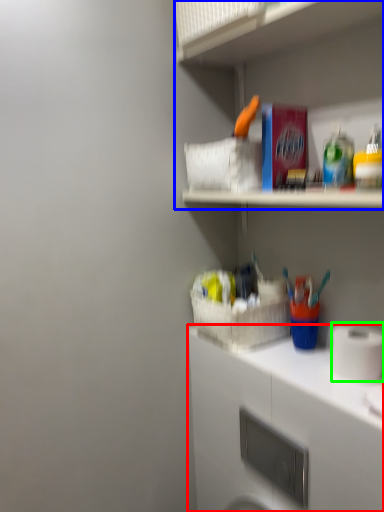
Question: Which object is the farthest from cabinetry (highlighted by a red box)? Choose among these: shelf (highlighted by a blue box) or toilet paper (highlighted by a green box).

Choices:
 (A) shelf
 (B) toilet paper

Answer: (A)